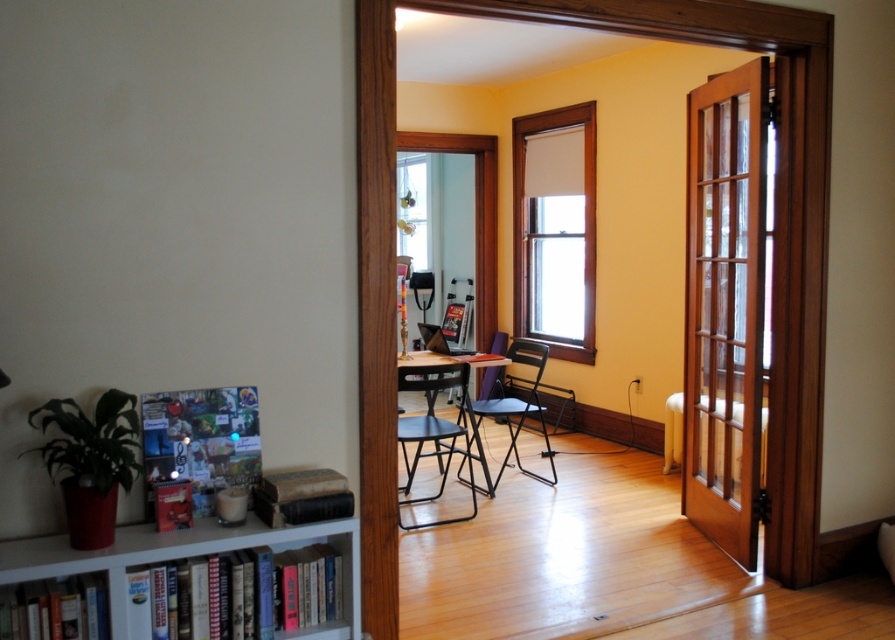
Question: Based on their relative distances, which object is nearer to the white glossy bookshelf at lower left?

Choices:
 (A) blue fabric chair at center
 (B) black metal chair at center
 (C) wooden frame at center

Answer: (B)

Question: Is wooden frame at center below black metal chair at center?

Choices:
 (A) no
 (B) yes

Answer: (A)

Question: Which object is closer to the camera taking this photo?

Choices:
 (A) black metal chair at center
 (B) blue fabric chair at center
 (C) mahogany wood door at right

Answer: (C)

Question: Is mahogany wood door at right wider than blue fabric chair at center?

Choices:
 (A) no
 (B) yes

Answer: (A)

Question: Is mahogany wood door at right closer to the viewer compared to wooden frame at center?

Choices:
 (A) yes
 (B) no

Answer: (A)

Question: Which object is positioned closest to the wooden frame at center?

Choices:
 (A) black metal chair at center
 (B) mahogany wood door at right
 (C) white glossy bookshelf at lower left

Answer: (A)